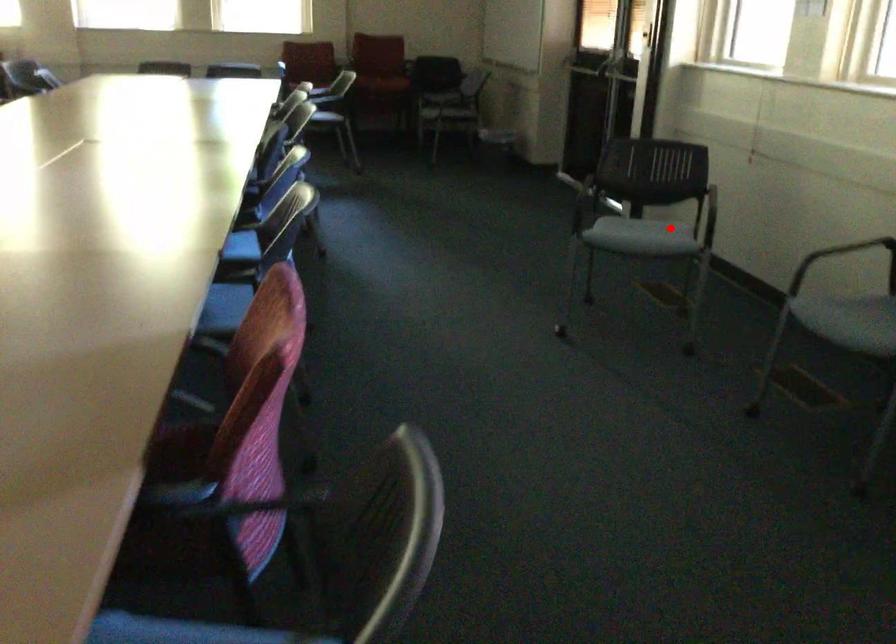
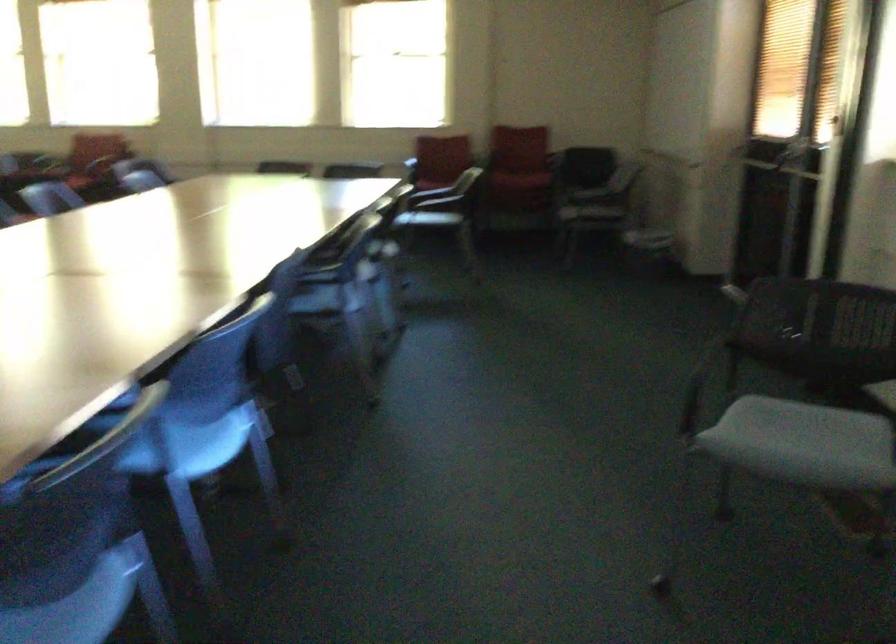
Question: I am providing you with two images of the same scene from different viewpoints. In image1, a red point is highlighted. Considering the same 3D point in image2, which of the following is correct?

Choices:
 (A) It is closer
 (B) It is farther

Answer: (A)